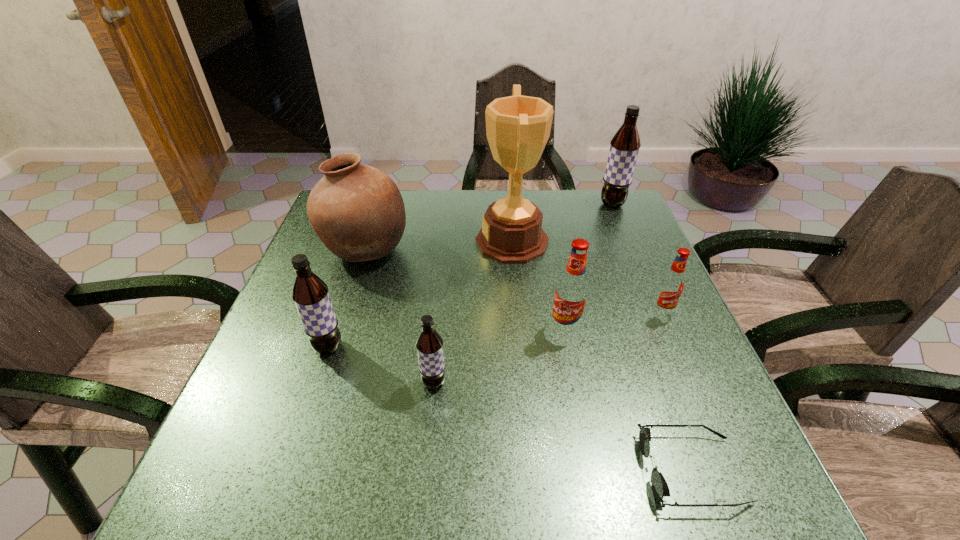
Where is `vacant region located on the front of the smaller red root beer`? The width and height of the screenshot is (960, 540). vacant region located on the front of the smaller red root beer is located at coordinates (x=698, y=396).

The image size is (960, 540). I want to click on vacant space located 0.300m on the left of the second brown root beer from left to right, so click(269, 382).

Image resolution: width=960 pixels, height=540 pixels. In order to click on vacant area situated on the front-facing side of the nearest object in this screenshot , I will do `click(490, 470)`.

Locate an element on the screen. free spot located on the front-facing side of the nearest object is located at coordinates (586, 470).

Locate an element on the screen. The image size is (960, 540). vacant space located on the front-facing side of the nearest object is located at coordinates (471, 470).

At what (x,y) coordinates should I click in order to perform the action: click on award present at the far edge. Please return your answer as a coordinate pair (x, y). This screenshot has width=960, height=540. Looking at the image, I should click on (518, 127).

This screenshot has height=540, width=960. What are the coordinates of `root beer located in the far edge section of the desktop` in the screenshot? It's located at (624, 147).

You are a GUI agent. You are given a task and a screenshot of the screen. Output one action in this format:
    pyautogui.click(x=<x>, y=<y>)
    Task: Click on the pottery that is positioned at the far edge
    The image size is (960, 540).
    Given the screenshot: What is the action you would take?
    pyautogui.click(x=357, y=211)

The width and height of the screenshot is (960, 540). Identify the location of object present at the near edge. (660, 488).

This screenshot has height=540, width=960. I want to click on pottery at the left edge, so click(357, 211).